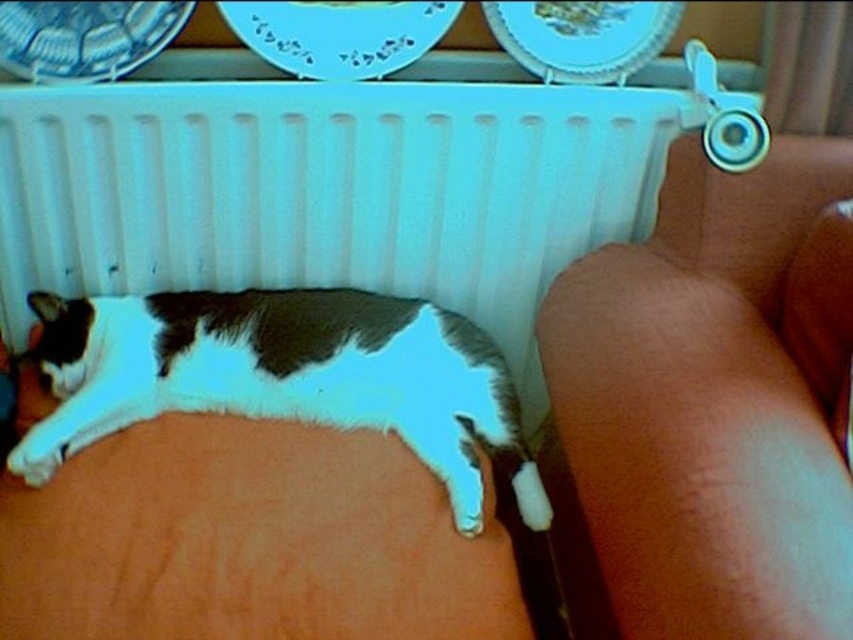
Does white plastic radiator at upper center have a greater height compared to white fur cat at lower left?

Correct, white plastic radiator at upper center is much taller as white fur cat at lower left.

Between white plastic radiator at upper center and white fur cat at lower left, which one is positioned lower?

white fur cat at lower left is below.

Between point (44, 216) and point (111, 420), which one is positioned in front?

Positioned in front is point (111, 420).

You are a GUI agent. You are given a task and a screenshot of the screen. Output one action in this format:
    pyautogui.click(x=<x>, y=<y>)
    Task: Click on the white plastic radiator at upper center
    
    Given the screenshot: What is the action you would take?
    (328, 192)

Who is taller, white plastic radiator at upper center or brown leather couch at lower right?

With more height is brown leather couch at lower right.

This screenshot has height=640, width=853. I want to click on white plastic radiator at upper center, so click(328, 192).

I want to click on white plastic radiator at upper center, so click(x=328, y=192).

Who is positioned more to the right, brown leather couch at lower right or white fur cat at lower left?

brown leather couch at lower right

From the picture: Who is lower down, brown leather couch at lower right or white fur cat at lower left?

white fur cat at lower left is below.

Does point (757, 404) come closer to viewer compared to point (370, 364)?

Yes, point (757, 404) is closer to viewer.

Image resolution: width=853 pixels, height=640 pixels. What are the coordinates of `brown leather couch at lower right` in the screenshot? It's located at (705, 410).